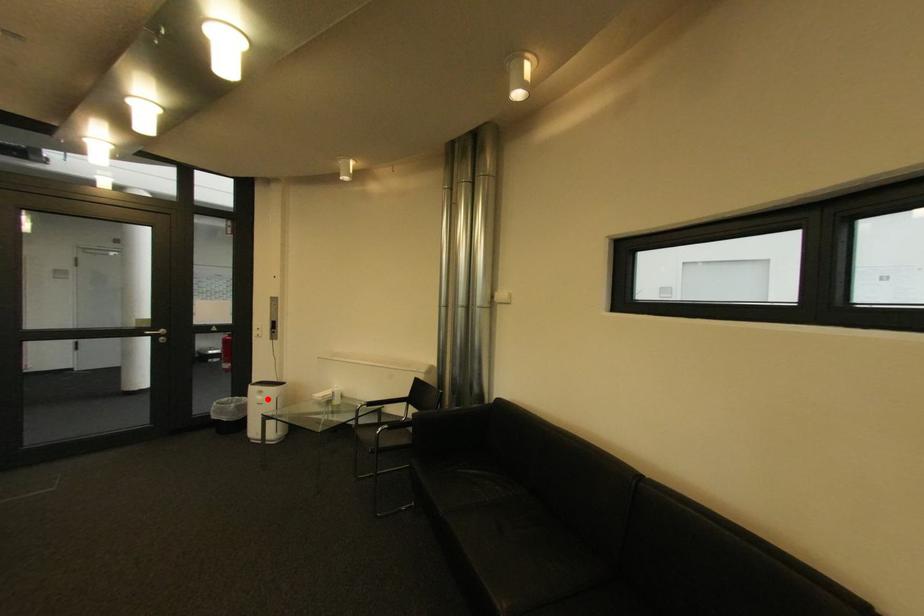
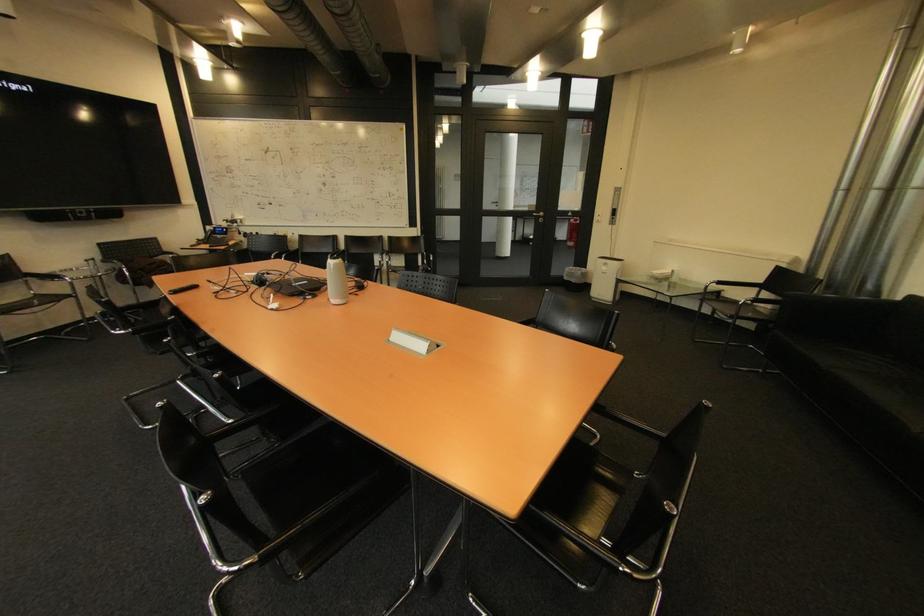
Where in the second image is the point corresponding to the highlighted location from the first image?

(613, 270)